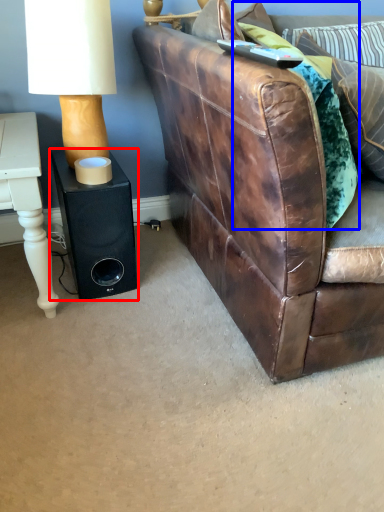
Question: Which object appears closest to the camera in this image, speaker (highlighted by a red box) or pillow (highlighted by a blue box)?

Choices:
 (A) speaker
 (B) pillow

Answer: (B)